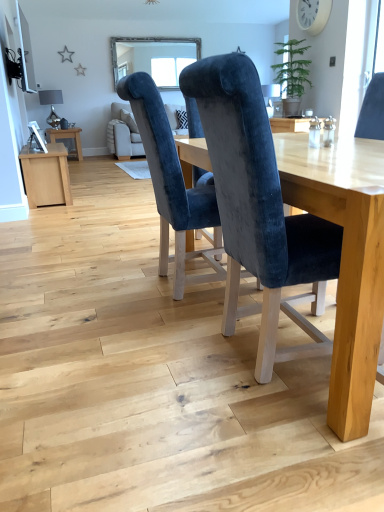
Question: From a real-world perspective, is clear glass window at upper center located beneath velvet blue chair at center, acting as the 1th chair starting from the left?

Choices:
 (A) yes
 (B) no

Answer: (B)

Question: Is clear glass window at upper center in front of velvet blue chair at center, acting as the 1th chair starting from the left?

Choices:
 (A) no
 (B) yes

Answer: (A)

Question: From the image's perspective, does clear glass window at upper center appear lower than velvet blue chair at center, acting as the 1th chair starting from the left?

Choices:
 (A) no
 (B) yes

Answer: (A)

Question: Is clear glass window at upper center placed right next to velvet blue chair at center, acting as the 1th chair starting from the left?

Choices:
 (A) no
 (B) yes

Answer: (A)

Question: Can you confirm if clear glass window at upper center is positioned to the right of velvet blue chair at center, acting as the 1th chair starting from the left?

Choices:
 (A) no
 (B) yes

Answer: (A)

Question: Is clear glass window at upper center aimed at velvet blue chair at center, acting as the 1th chair starting from the left?

Choices:
 (A) no
 (B) yes

Answer: (B)

Question: Does wooden side table at left come behind velvet blue chair at center, the first chair positioned from the right?

Choices:
 (A) no
 (B) yes

Answer: (B)

Question: Can you confirm if wooden side table at left is thinner than velvet blue chair at center, the first chair positioned from the right?

Choices:
 (A) no
 (B) yes

Answer: (B)

Question: From the image's perspective, is wooden side table at left located beneath velvet blue chair at center, the first chair positioned from the right?

Choices:
 (A) yes
 (B) no

Answer: (B)

Question: Is the position of wooden side table at left less distant than that of velvet blue chair at center, the second chair in the left-to-right sequence?

Choices:
 (A) yes
 (B) no

Answer: (B)

Question: Is wooden side table at left next to velvet blue chair at center, the first chair positioned from the right?

Choices:
 (A) no
 (B) yes

Answer: (A)

Question: Can you confirm if wooden side table at left is positioned to the right of velvet blue chair at center, the second chair in the left-to-right sequence?

Choices:
 (A) yes
 (B) no

Answer: (B)

Question: Considering the relative sizes of velvet blue chair at center, the second chair from the right, and velvet blue chair at center, the first chair positioned from the right, in the image provided, is velvet blue chair at center, the second chair from the right, wider than velvet blue chair at center, the first chair positioned from the right,?

Choices:
 (A) no
 (B) yes

Answer: (A)